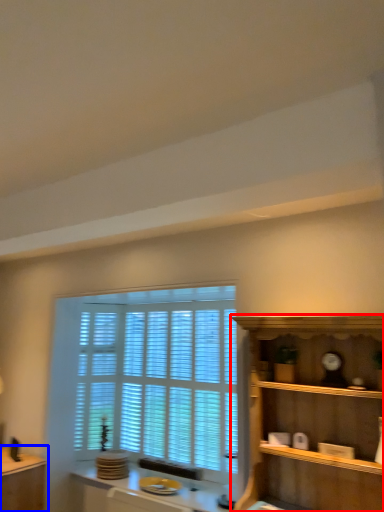
Question: Which object appears closest to the camera in this image, shelf (highlighted by a red box) or table (highlighted by a blue box)?

Choices:
 (A) shelf
 (B) table

Answer: (A)